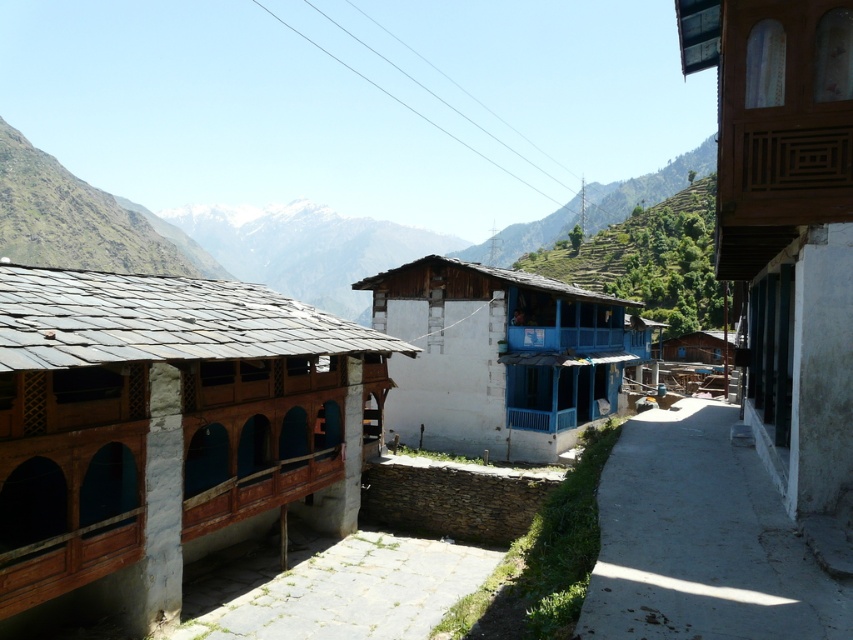
Who is taller, wooden balcony at right or white painted wood at center?

With more height is white painted wood at center.

Does wooden balcony at right have a greater width compared to white painted wood at center?

In fact, wooden balcony at right might be narrower than white painted wood at center.

What do you see at coordinates (786, 221) in the screenshot? I see `wooden balcony at right` at bounding box center [786, 221].

At what (x,y) coordinates should I click in order to perform the action: click on wooden balcony at right. Please return your answer as a coordinate pair (x, y). Looking at the image, I should click on (786, 221).

Identify the location of concrete at center. (701, 540).

Can you confirm if concrete at center is positioned below green grassy mountain at upper left?

Indeed, concrete at center is positioned under green grassy mountain at upper left.

Which is behind, point (717, 509) or point (103, 252)?

Positioned behind is point (103, 252).

What are the coordinates of `concrete at center` in the screenshot? It's located at (701, 540).

Is green grassy mountain at upper left to the right of green grassy hillside at center from the viewer's perspective?

No, green grassy mountain at upper left is not to the right of green grassy hillside at center.

Which is behind, point (152, 266) or point (558, 209)?

The point (558, 209) is behind.

Where is `green grassy mountain at upper left`? green grassy mountain at upper left is located at coordinates (83, 220).